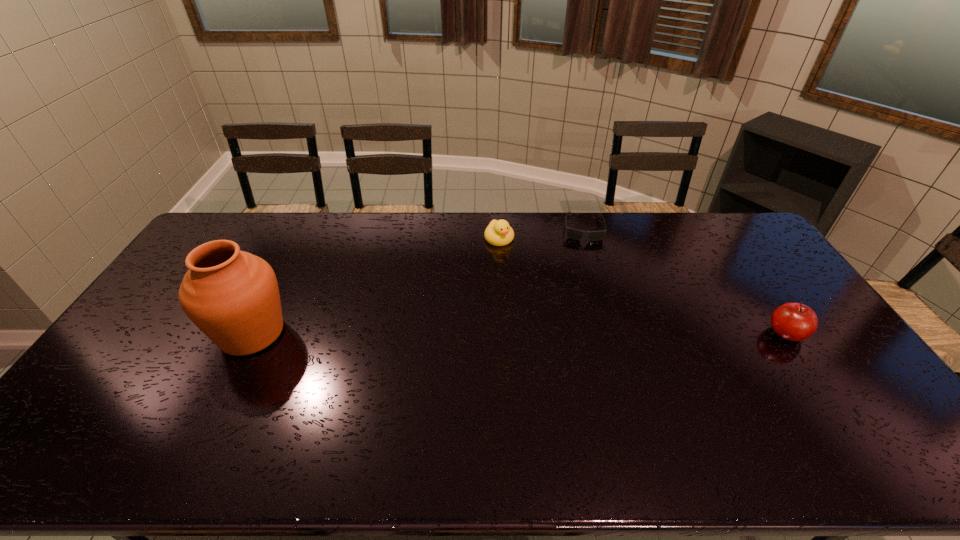
The image size is (960, 540). Find the location of `the leftmost object`. the leftmost object is located at coordinates (232, 296).

You are a GUI agent. You are given a task and a screenshot of the screen. Output one action in this format:
    pyautogui.click(x=<x>, y=<y>)
    Task: Click on the urn
    This screenshot has width=960, height=540.
    Given the screenshot: What is the action you would take?
    pyautogui.click(x=232, y=296)

Where is `apple`? apple is located at coordinates (792, 321).

Locate an element on the screen. The width and height of the screenshot is (960, 540). the second tallest object is located at coordinates (792, 321).

Where is `duckling`? The width and height of the screenshot is (960, 540). duckling is located at coordinates (499, 233).

At what (x,y) coordinates should I click in order to perform the action: click on the third object from right to left. Please return your answer as a coordinate pair (x, y). Image resolution: width=960 pixels, height=540 pixels. Looking at the image, I should click on (499, 233).

Identify the location of the third object from left to right. Image resolution: width=960 pixels, height=540 pixels. (572, 233).

You are a GUI agent. You are given a task and a screenshot of the screen. Output one action in this format:
    pyautogui.click(x=<x>, y=<y>)
    Task: Click on the shortest object
    Image resolution: width=960 pixels, height=540 pixels.
    Given the screenshot: What is the action you would take?
    pyautogui.click(x=572, y=233)

You are a GUI agent. You are given a task and a screenshot of the screen. Output one action in this format:
    pyautogui.click(x=<x>, y=<y>)
    Task: Click on the vacant space located on the back of the leftmost object
    This screenshot has height=540, width=960.
    Given the screenshot: What is the action you would take?
    pyautogui.click(x=282, y=273)

Find the location of a particular element. This screenshot has height=540, width=960. free space located on the left of the second tallest object is located at coordinates (706, 334).